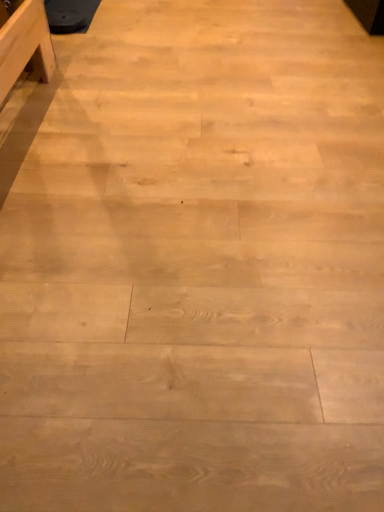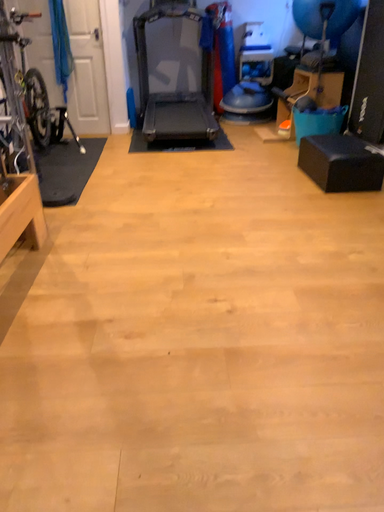
Question: Which way did the camera rotate in the video?

Choices:
 (A) rotated upward
 (B) rotated downward

Answer: (A)